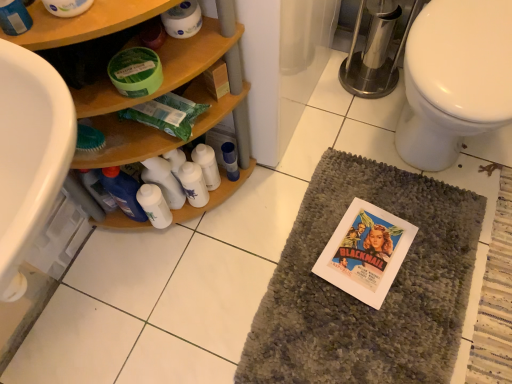
Locate an element on the screen. free space in front of woodenmaterial/texturebathroom cabinet at left is located at coordinates (175, 305).